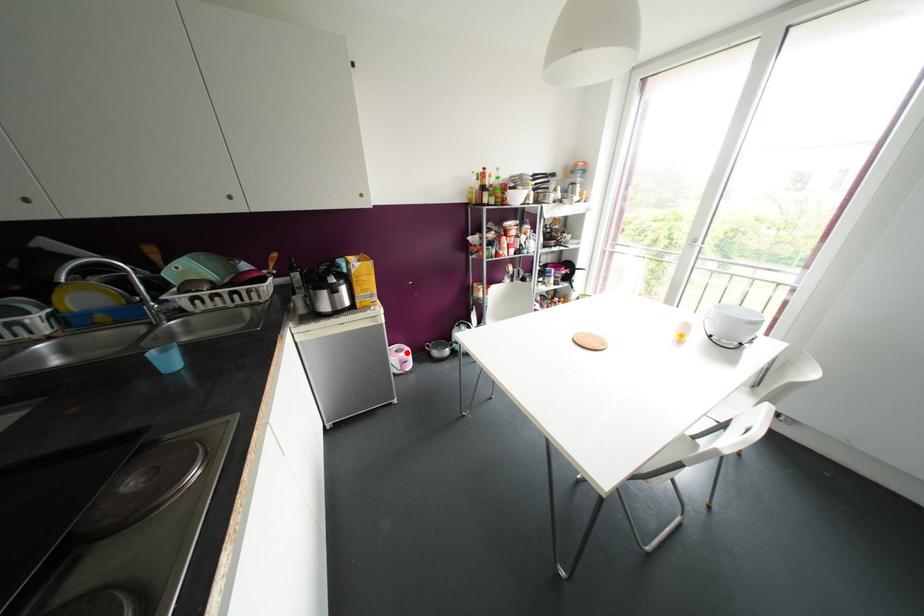
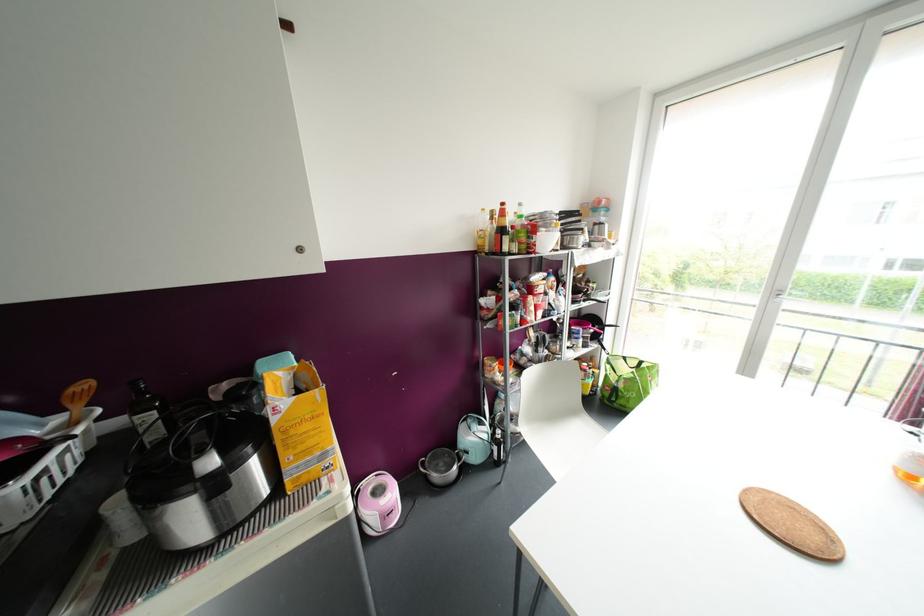
Where in the second image is the point corresponding to the highlighted location from the first image?

(392, 493)